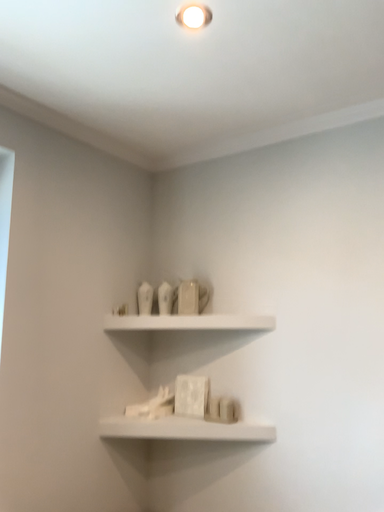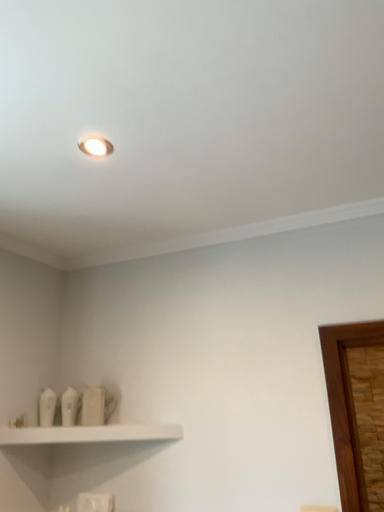
Question: Which way did the camera rotate in the video?

Choices:
 (A) rotated upward
 (B) rotated downward

Answer: (A)